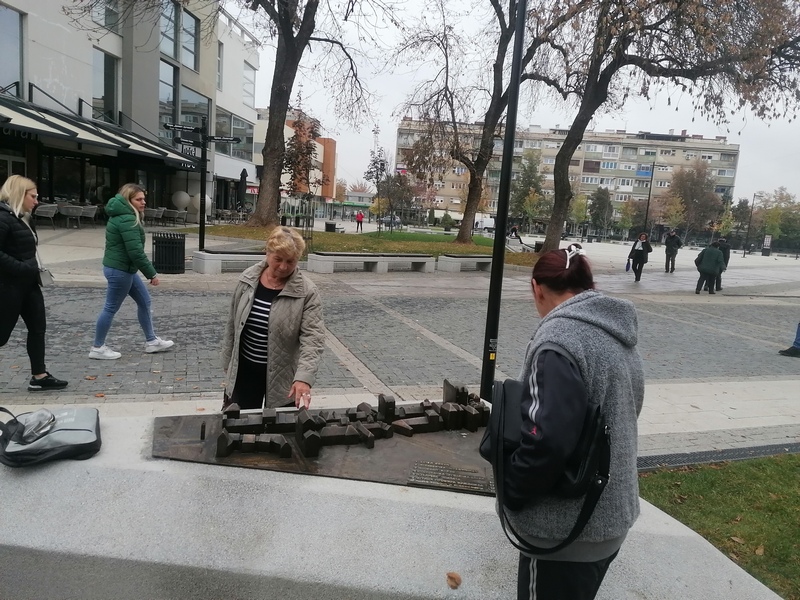
Identify the location of sculpture plaque. The image size is (800, 600). (436, 474).